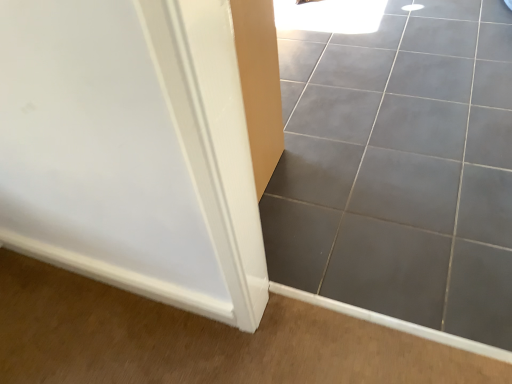
Image resolution: width=512 pixels, height=384 pixels. What do you see at coordinates (400, 168) in the screenshot?
I see `gray matte tile at center` at bounding box center [400, 168].

Where is `gray matte tile at center`? Image resolution: width=512 pixels, height=384 pixels. gray matte tile at center is located at coordinates (400, 168).

Locate an element on the screen. gray matte tile at center is located at coordinates (400, 168).